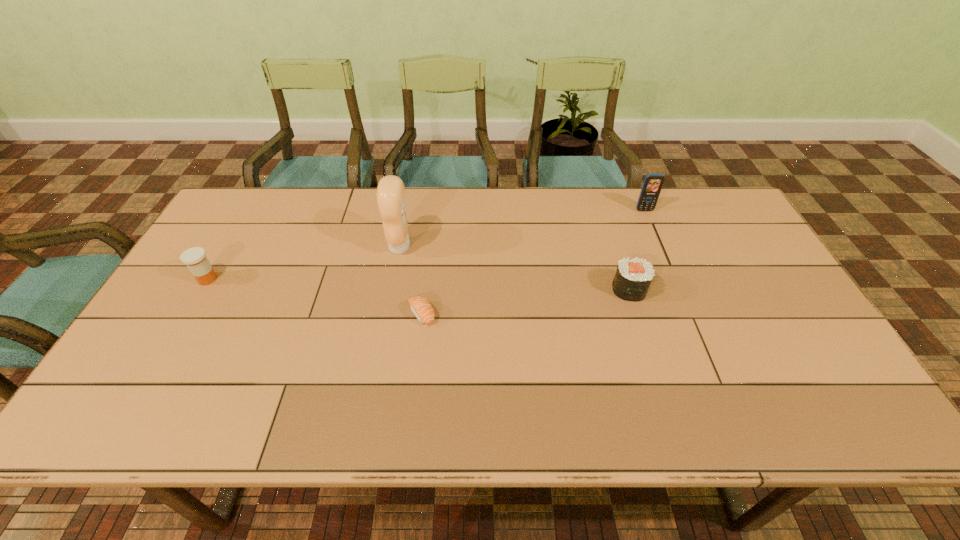
This screenshot has width=960, height=540. In order to click on vacant area that lies between the medicine and the fourth object from left to right in this screenshot , I will do `click(419, 284)`.

This screenshot has height=540, width=960. I want to click on object that stands as the closest to the fourth nearest object, so click(420, 306).

Locate which object is the third closest to the fourth object from right to left. Please provide its 2D coordinates. Your answer should be formatted as a tuple, i.e. [(x, y)], where the tuple contains the x and y coordinates of a point satisfying the conditions above.

[(633, 277)]

Find the location of `vacant area that satisfies the following two spatial constraints: 1. on the screen of the fourth shortest object; 2. on the label of the tallest object`. vacant area that satisfies the following two spatial constraints: 1. on the screen of the fourth shortest object; 2. on the label of the tallest object is located at coordinates (660, 246).

Image resolution: width=960 pixels, height=540 pixels. In order to click on blank area in the image that satisfies the following two spatial constraints: 1. on the screen of the fourth shortest object; 2. on the label of the fourth object from right to left in this screenshot , I will do pos(660,246).

This screenshot has width=960, height=540. What are the coordinates of `free space in the image that satisfies the following two spatial constraints: 1. on the screen of the farthest object; 2. on the label of the tallest object` in the screenshot? It's located at (660, 246).

Where is `free spot that satisfies the following two spatial constraints: 1. on the label of the leftmost object; 2. on the right side of the taller sushi`? free spot that satisfies the following two spatial constraints: 1. on the label of the leftmost object; 2. on the right side of the taller sushi is located at coordinates (202, 289).

Where is `vacant region that satisfies the following two spatial constraints: 1. on the label of the medicine; 2. on the back side of the second object from right to left`? This screenshot has height=540, width=960. vacant region that satisfies the following two spatial constraints: 1. on the label of the medicine; 2. on the back side of the second object from right to left is located at coordinates (202, 289).

The height and width of the screenshot is (540, 960). In order to click on blank space that satisfies the following two spatial constraints: 1. on the screen of the farthest object; 2. on the label of the leftmost object in this screenshot , I will do `click(673, 279)`.

You are a GUI agent. You are given a task and a screenshot of the screen. Output one action in this format:
    pyautogui.click(x=<x>, y=<y>)
    Task: Click on the free space that satisfies the following two spatial constraints: 1. on the label of the fourth object from right to left; 2. on the back side of the left sushi
    This screenshot has height=540, width=960.
    Given the screenshot: What is the action you would take?
    pyautogui.click(x=387, y=314)